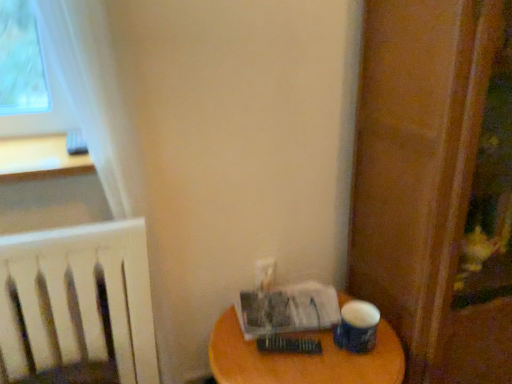
Where is `free spot behind hardcover book at center, the 2th paperback book in the back-to-front sequence`? Image resolution: width=512 pixels, height=384 pixels. free spot behind hardcover book at center, the 2th paperback book in the back-to-front sequence is located at coordinates (290, 312).